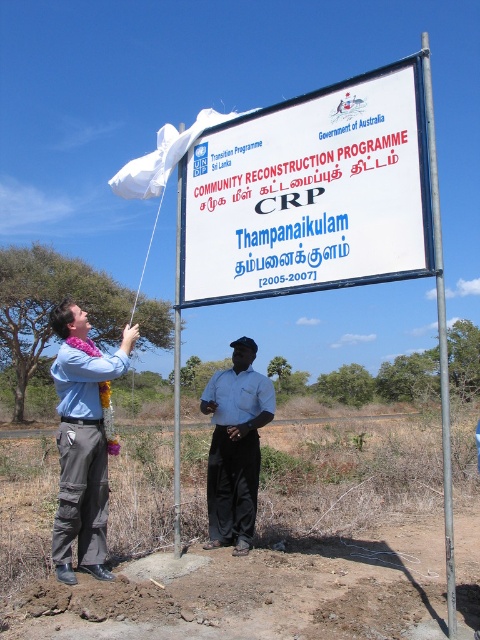
Question: Which point appears farthest from the camera in this image?

Choices:
 (A) (189, 186)
 (B) (451, 637)
 (C) (78, 412)

Answer: (A)

Question: Which object appears farthest from the camera in this image?

Choices:
 (A) metallic pole at center
 (B) white shirt at center

Answer: (B)

Question: Is white plastic sign at upper center closer to the viewer compared to white shirt at center?

Choices:
 (A) yes
 (B) no

Answer: (A)

Question: Is white shirt at center thinner than silver metallic pole at upper center?

Choices:
 (A) yes
 (B) no

Answer: (A)

Question: Is white plastic sign at upper center bigger than matte blue shirt at left?

Choices:
 (A) no
 (B) yes

Answer: (A)

Question: Which of these objects is positioned closest to the brown soil at lower center?

Choices:
 (A) silver metallic pole at upper center
 (B) matte blue shirt at left
 (C) white plastic sign at upper center

Answer: (A)